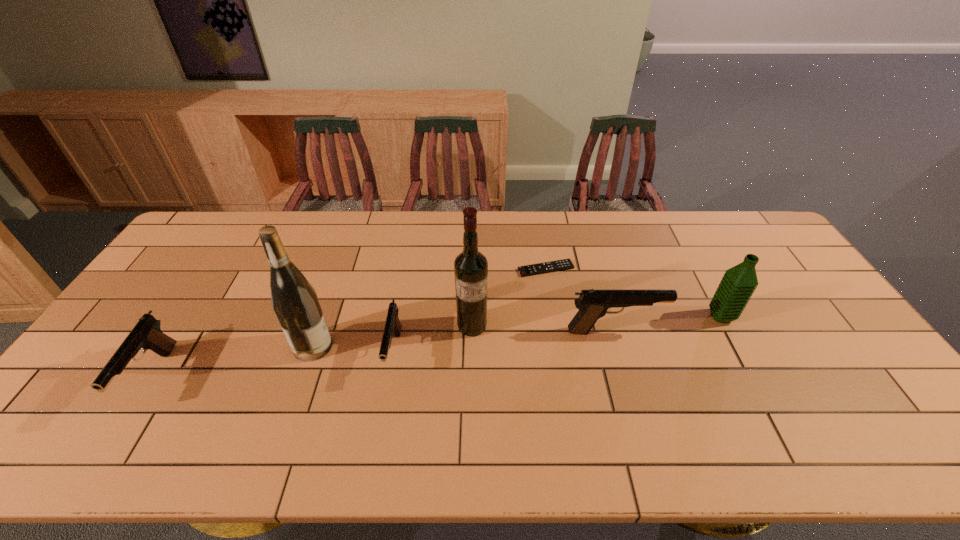
Find the location of a particular element. The width and height of the screenshot is (960, 540). the fourth object from left to right is located at coordinates (470, 267).

You are a GUI agent. You are given a task and a screenshot of the screen. Output one action in this format:
    pyautogui.click(x=<x>, y=<y>)
    Task: Click on the free spot located at the muzzle of the rightmost pistol
    
    Given the screenshot: What is the action you would take?
    pyautogui.click(x=767, y=330)

Identify the location of vacant space located 0.190m on the left of the sixth object from right to left. This screenshot has height=540, width=960. (224, 346).

Locate an element on the screen. The width and height of the screenshot is (960, 540). vacant position located on the back of the farthest object is located at coordinates (540, 238).

Locate an element on the screen. This screenshot has width=960, height=540. blank area located 0.100m on the right of the third tallest object is located at coordinates (767, 316).

Find the location of a particular element. blank space located 0.060m on the front and back of the right wine bottle is located at coordinates (471, 355).

This screenshot has height=540, width=960. Identify the location of object that is at the near edge. (146, 334).

This screenshot has height=540, width=960. In order to click on vacant space at the far edge in this screenshot , I will do `click(514, 224)`.

Identify the location of free space at the left edge of the desktop. This screenshot has width=960, height=540. (155, 309).

Locate an element on the screen. The image size is (960, 540). free space at the right edge of the desktop is located at coordinates (796, 294).